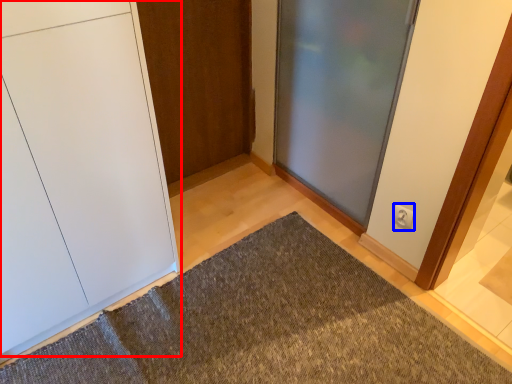
Question: Which object is further to the camera taking this photo, door (highlighted by a red box) or electric outlet (highlighted by a blue box)?

Choices:
 (A) door
 (B) electric outlet

Answer: (B)